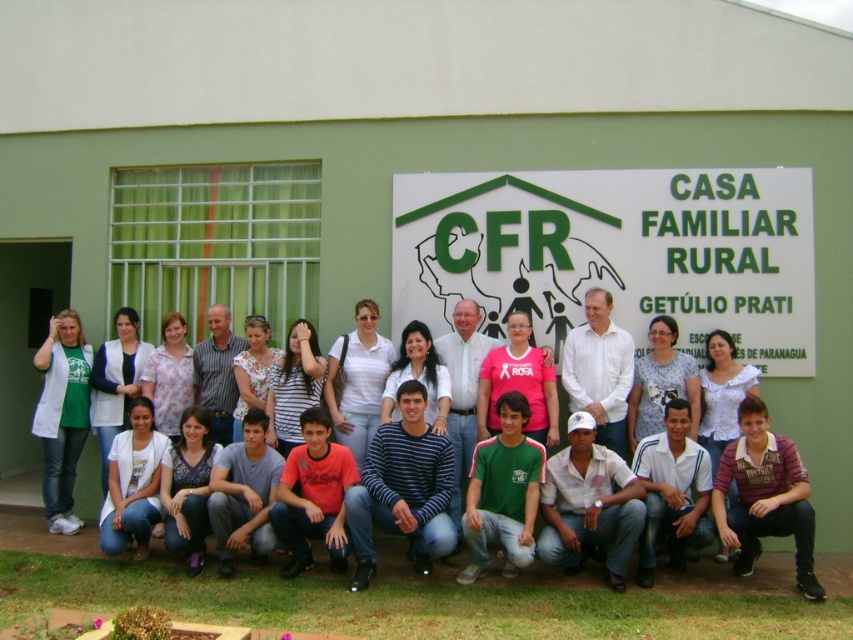
You are a photographer trying to frame a shot that includes both the green matte sign at center and the striped shirt at center. Which object should you adjust the camera angle to prioritize if you want to ensure the smaller one is fully visible?

The striped shirt at center is smaller than the green matte sign at center, so you should adjust the camera angle to prioritize the striped shirt at center to ensure it is fully visible.

You are standing in front of the building with the green matte sign at center. If you walk directly towards the sign, will you be facing the building?

Yes, because the green matte sign at center is mounted on the building, so walking directly toward it means facing the building.

You are standing in front of the building and see two people wearing shirts. One is wearing a white matte shirt at center and the other a white cotton shirt at lower left. Which shirt is positioned higher from the ground?

The white matte shirt at center is located above the white cotton shirt at lower left, so it is positioned higher from the ground.